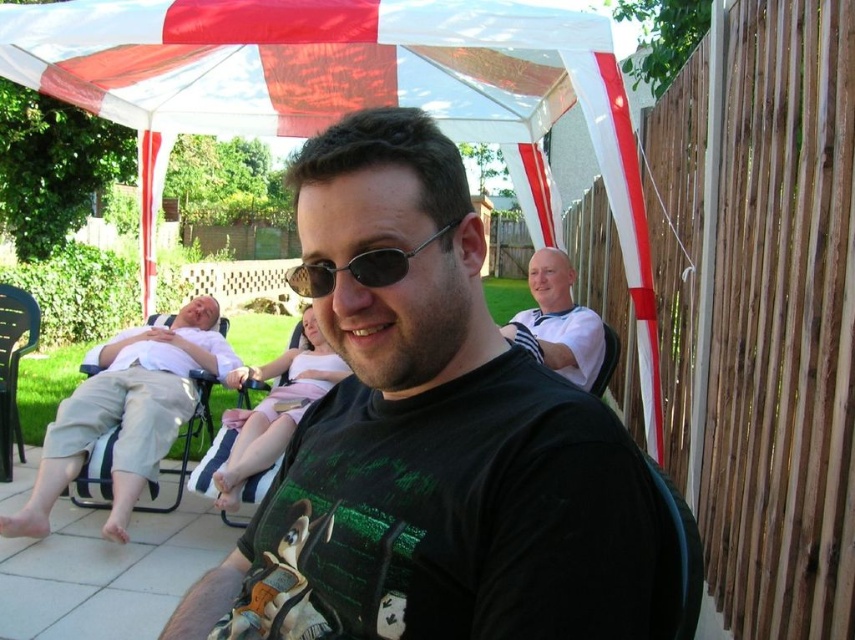
You are standing in the backyard and want to take a photo of the two points mentioned. Which point, point (565, 332) or point (208, 394), will appear larger in the photo?

Point (565, 332) will appear larger in the photo because it is closer to the camera than point (208, 394).

You are organizing a small outdoor event and need to seat guests. You have a space that can only accommodate chairs with a width of 40 cm or less. You see the black plastic chair at left and the white plastic chair at left. Which chair should you choose to fit the space?

The black plastic chair at left has a width less than the white plastic chair at left, so the black plastic chair at left is suitable for the space with a 40 cm width limit.

You are standing at the position of the man under the red and white canopy tent. You want to walk to the point marked as point (111, 458). Will you pass by point (596, 586) on your way there?

Yes, because point (596, 586) is in front of point (111, 458), so you will pass by point (596, 586) on your way to point (111, 458).